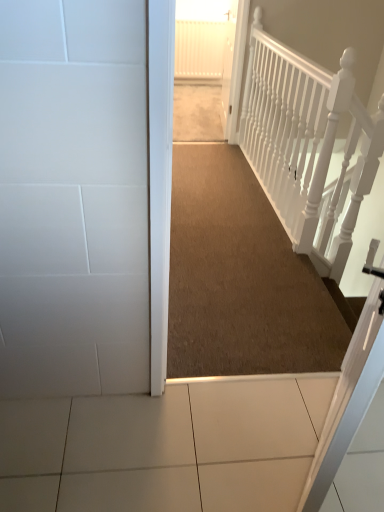
Question: Is white textured rail at upper right at the back of carpeted hallway at center?

Choices:
 (A) yes
 (B) no

Answer: (B)

Question: From a real-world perspective, is carpeted hallway at center over white textured rail at upper right?

Choices:
 (A) yes
 (B) no

Answer: (B)

Question: Is carpeted hallway at center positioned in front of white textured rail at upper right?

Choices:
 (A) no
 (B) yes

Answer: (A)

Question: Does carpeted hallway at center have a smaller size compared to white textured rail at upper right?

Choices:
 (A) no
 (B) yes

Answer: (A)

Question: Is carpeted hallway at center behind white textured rail at upper right?

Choices:
 (A) yes
 (B) no

Answer: (A)

Question: Is brown carpet at center taller or shorter than carpeted hallway at center?

Choices:
 (A) tall
 (B) short

Answer: (B)

Question: Considering the positions of brown carpet at center and carpeted hallway at center in the image, is brown carpet at center wider or thinner than carpeted hallway at center?

Choices:
 (A) thin
 (B) wide

Answer: (B)

Question: From the image's perspective, is brown carpet at center positioned above or below carpeted hallway at center?

Choices:
 (A) above
 (B) below

Answer: (B)

Question: In the image, is brown carpet at center positioned in front of or behind carpeted hallway at center?

Choices:
 (A) behind
 (B) front

Answer: (B)

Question: Would you say white textured rail at upper right is to the left or to the right of brown carpet at center in the picture?

Choices:
 (A) left
 (B) right

Answer: (B)

Question: From the image's perspective, is white textured rail at upper right positioned above or below brown carpet at center?

Choices:
 (A) above
 (B) below

Answer: (B)

Question: Is white textured rail at upper right wider or thinner than brown carpet at center?

Choices:
 (A) thin
 (B) wide

Answer: (A)

Question: Is white textured rail at upper right taller or shorter than brown carpet at center?

Choices:
 (A) tall
 (B) short

Answer: (A)

Question: Considering the relative positions of carpeted hallway at center and white textured rail at upper right in the image provided, is carpeted hallway at center to the left or to the right of white textured rail at upper right?

Choices:
 (A) left
 (B) right

Answer: (A)

Question: Relative to white textured rail at upper right, is carpeted hallway at center in front or behind?

Choices:
 (A) front
 (B) behind

Answer: (B)